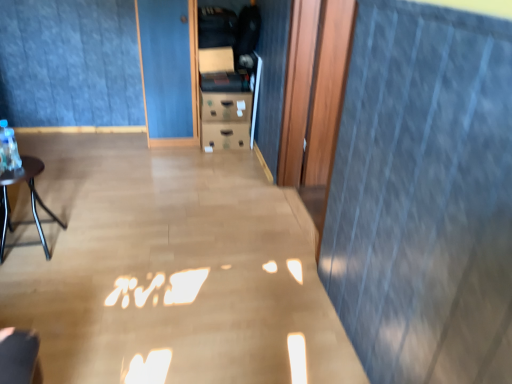
Where is `vacant area that is in front of blue fabric curtain at upper center`? This screenshot has width=512, height=384. vacant area that is in front of blue fabric curtain at upper center is located at coordinates (137, 200).